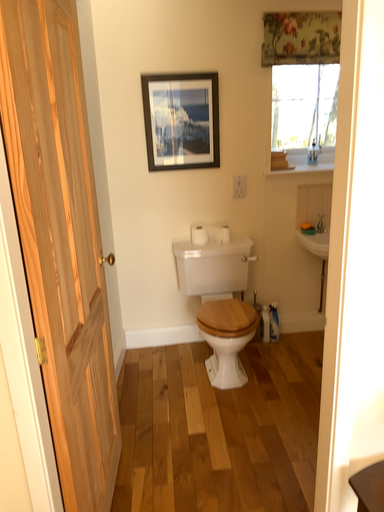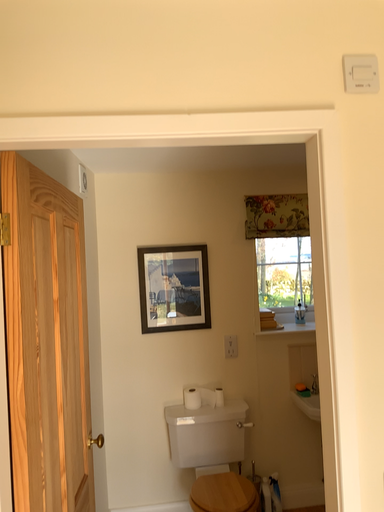
Question: How did the camera likely rotate when shooting the video?

Choices:
 (A) rotated upward
 (B) rotated downward

Answer: (A)